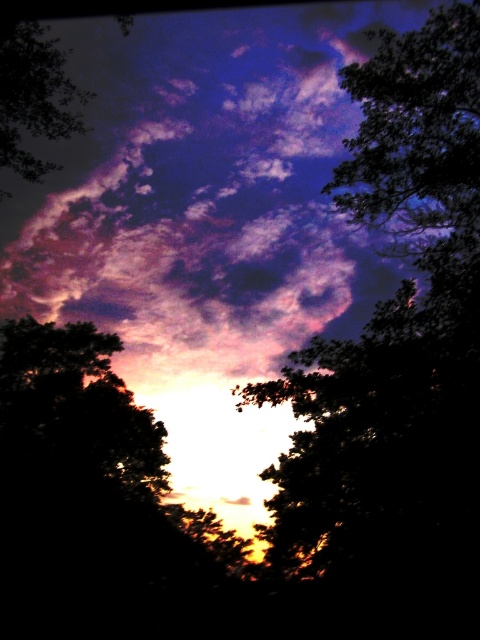
Can you confirm if silhouette leafy tree at upper right is shorter than silhouette leafy tree at upper left?

In fact, silhouette leafy tree at upper right may be taller than silhouette leafy tree at upper left.

In the scene shown: Which of these two, silhouette leafy tree at upper right or silhouette leafy tree at upper left, stands shorter?

With less height is silhouette leafy tree at upper left.

What do you see at coordinates (417, 131) in the screenshot? I see `silhouette leafy tree at upper right` at bounding box center [417, 131].

This screenshot has height=640, width=480. I want to click on silhouette leafy tree at upper right, so click(x=417, y=131).